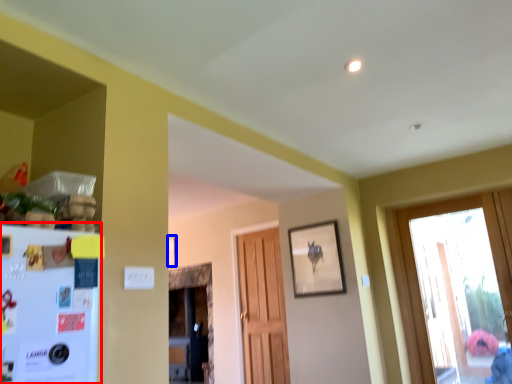
Question: Which point is further to the camera, fridge (highlighted by a red box) or picture frame (highlighted by a blue box)?

Choices:
 (A) fridge
 (B) picture frame

Answer: (B)